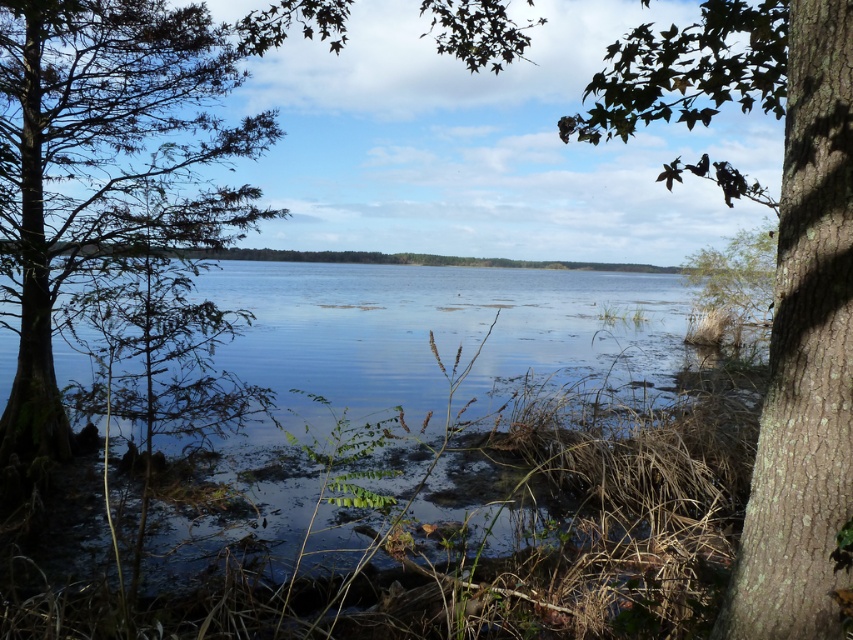
Question: Which point is farther to the camera?

Choices:
 (A) brown rough bark tree at right
 (B) clear water at center
 (C) green mossy tree at left

Answer: (C)

Question: Which point appears closest to the camera in this image?

Choices:
 (A) (647, 340)
 (B) (735, 177)
 (C) (161, 173)

Answer: (B)

Question: Is clear water at center in front of green mossy tree at left?

Choices:
 (A) yes
 (B) no

Answer: (A)

Question: Is brown rough bark tree at right to the right of green mossy tree at left from the viewer's perspective?

Choices:
 (A) yes
 (B) no

Answer: (A)

Question: Which object is closer to the camera taking this photo?

Choices:
 (A) clear water at center
 (B) brown rough bark tree at right
 (C) green mossy tree at left

Answer: (B)

Question: Does clear water at center appear on the left side of green mossy tree at left?

Choices:
 (A) yes
 (B) no

Answer: (B)